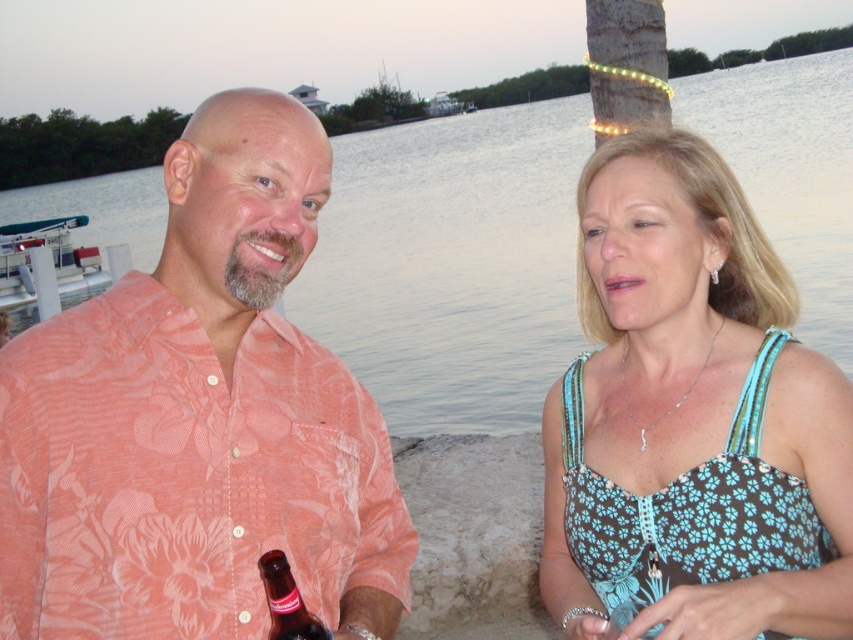
Question: Can you confirm if blue floral fabric dress at upper right is smaller than clear water at center?

Choices:
 (A) no
 (B) yes

Answer: (B)

Question: Which point is closer to the camera?

Choices:
 (A) (519, 132)
 (B) (699, 289)
 (C) (283, 595)

Answer: (C)

Question: Which object is closer to the camera taking this photo?

Choices:
 (A) clear water at center
 (B) blue floral fabric dress at upper right

Answer: (B)

Question: Can you confirm if blue floral fabric dress at upper right is thinner than clear water at center?

Choices:
 (A) yes
 (B) no

Answer: (A)

Question: Does pink floral shirt at left appear under brown glass bottle at lower left?

Choices:
 (A) yes
 (B) no

Answer: (B)

Question: Which of the following is the farthest from the observer?

Choices:
 (A) pink floral shirt at left
 (B) brown glass bottle at lower left
 (C) blue floral fabric dress at upper right

Answer: (C)